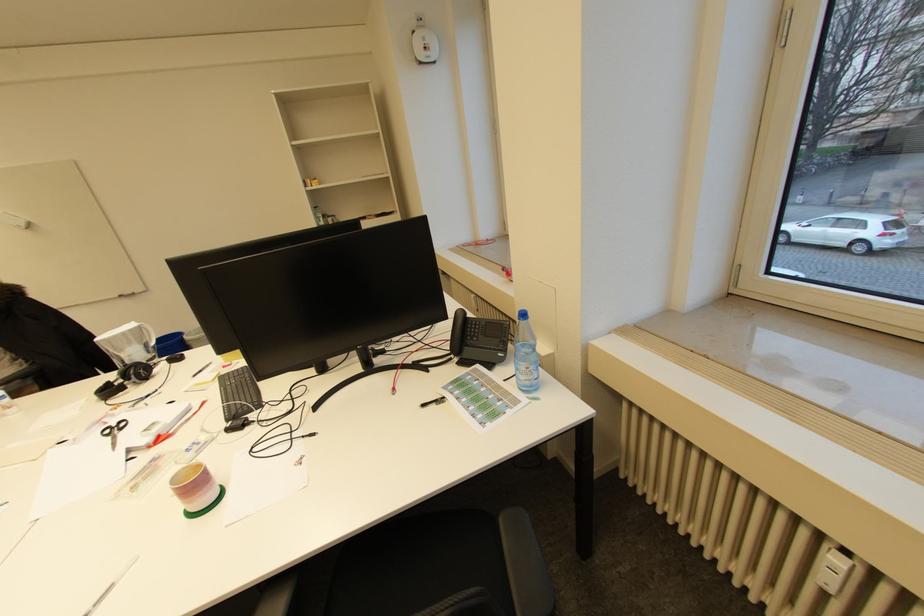
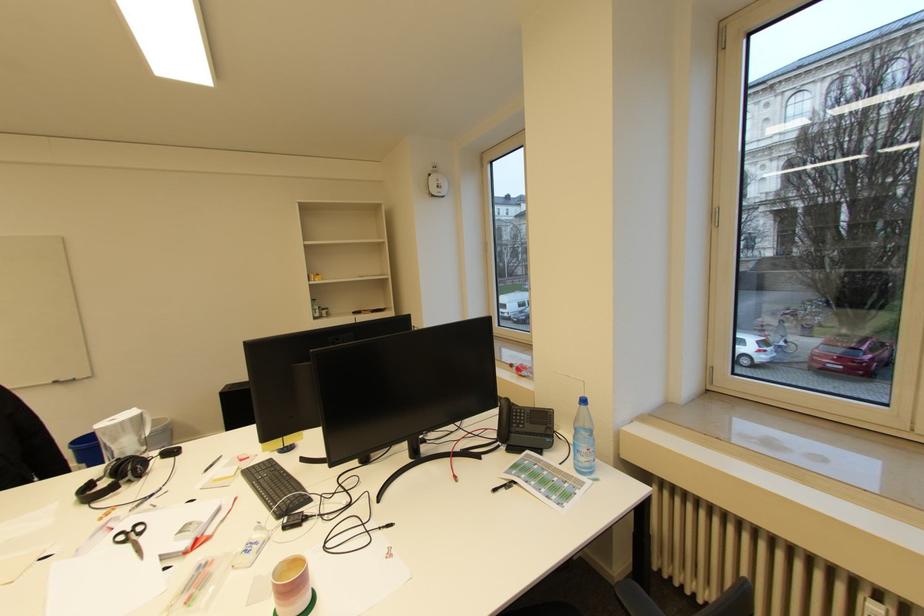
Find the pixel in the second image that matches the point at 127,422 in the first image.

(141, 525)